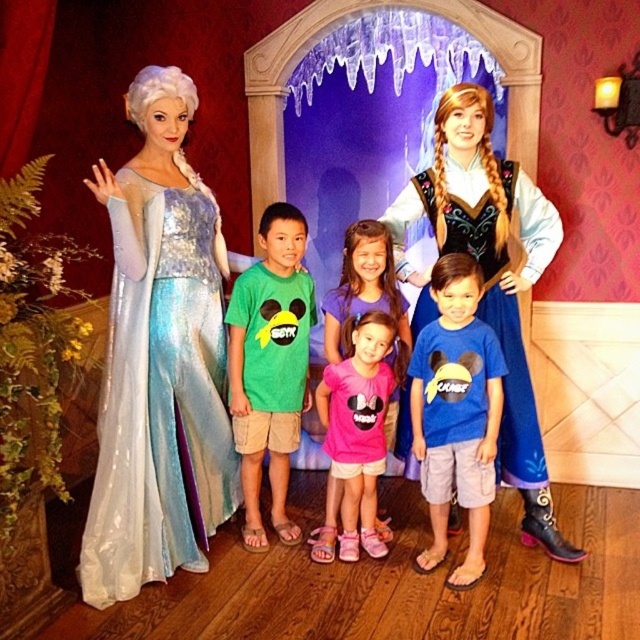
Question: Is blue cotton shirt at center smaller than blue satin dress at upper right?

Choices:
 (A) yes
 (B) no

Answer: (A)

Question: Is blue cotton shirt at center smaller than blue satin dress at upper right?

Choices:
 (A) no
 (B) yes

Answer: (B)

Question: Which of the following is the farthest from the observer?

Choices:
 (A) (476, 237)
 (B) (480, 524)
 (C) (278, 292)
 (D) (97, 548)

Answer: (C)

Question: Can you confirm if matte silver gown at left is smaller than pink fabric shirt at center?

Choices:
 (A) no
 (B) yes

Answer: (A)

Question: Which point is farther to the camera?

Choices:
 (A) (115, 403)
 (B) (387, 349)

Answer: (B)

Question: Which point is closer to the camera taking this photo?

Choices:
 (A) (410, 404)
 (B) (129, 388)

Answer: (B)